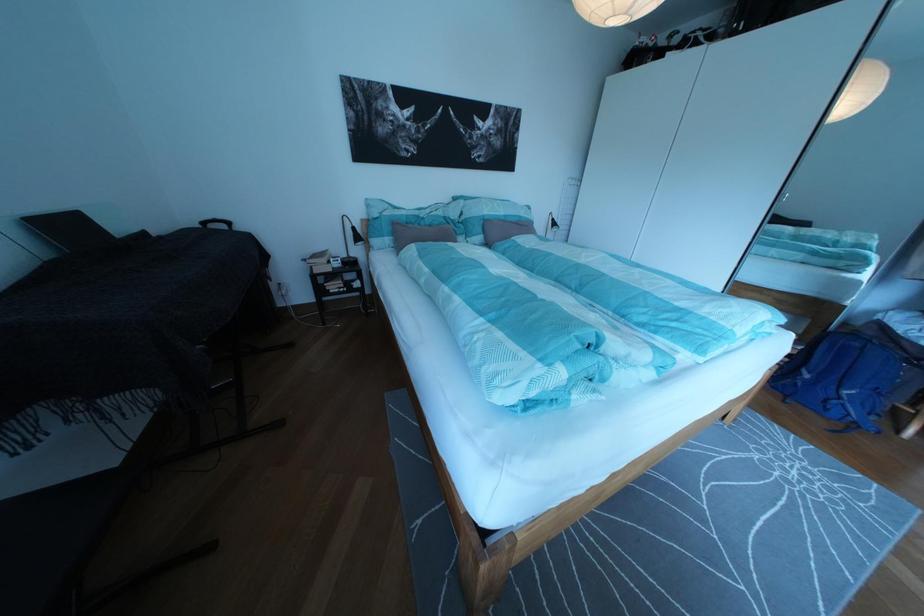
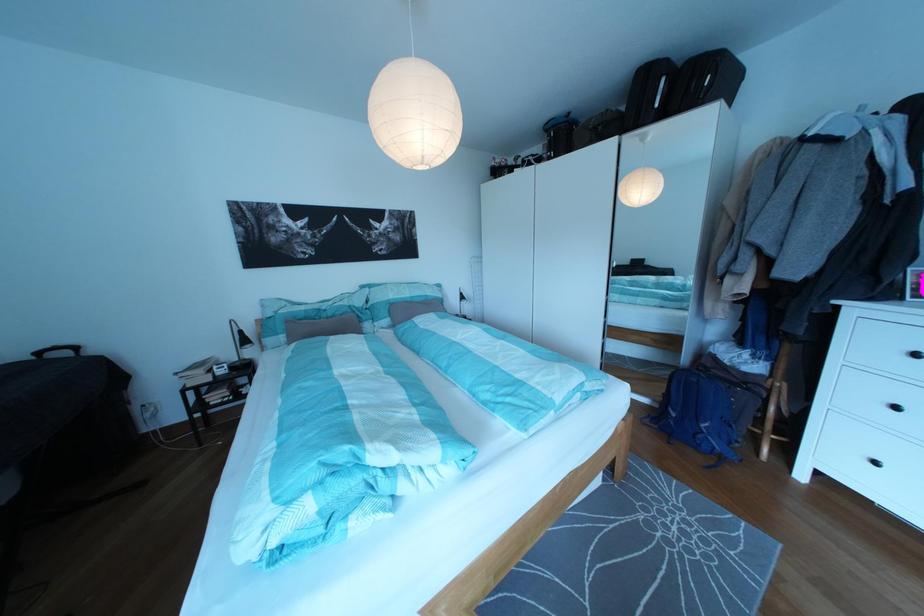
Question: What movement of the cameraman would produce the second image?

Choices:
 (A) Left
 (B) Right
 (C) Forward
 (D) Backward

Answer: (B)